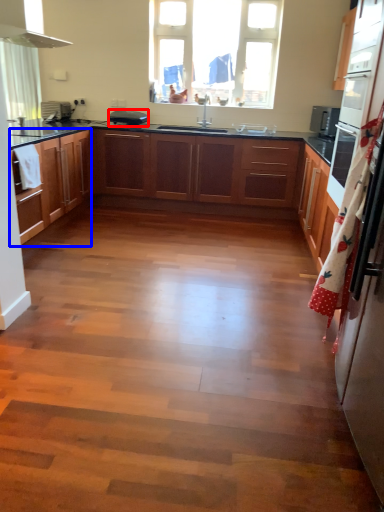
Question: Which object is closer to the camera taking this photo, appliance (highlighted by a red box) or cabinetry (highlighted by a blue box)?

Choices:
 (A) appliance
 (B) cabinetry

Answer: (B)